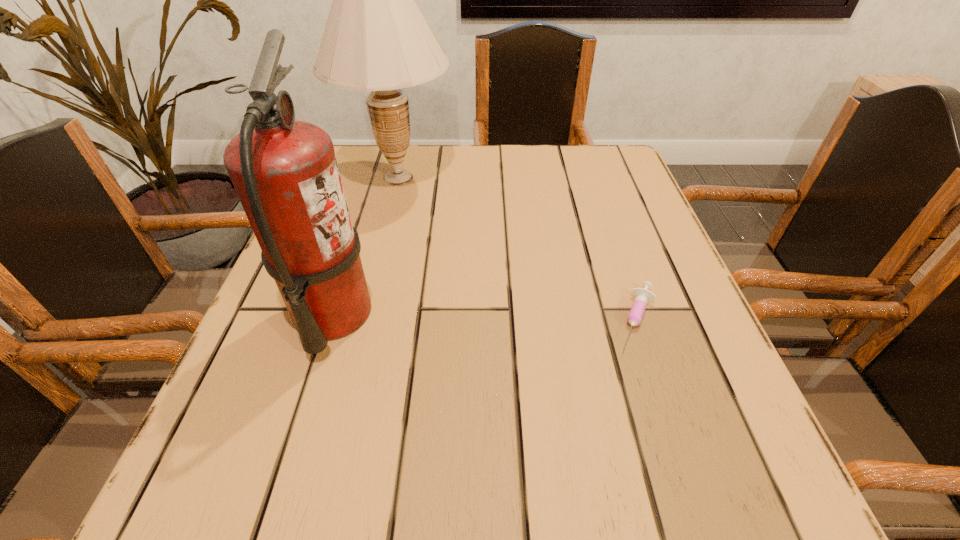
The width and height of the screenshot is (960, 540). Identify the location of object identified as the closest to the fire extinguisher. (376, 39).

Identify which object is located as the nearest to the farthest object. Please provide its 2D coordinates. Your answer should be formatted as a tuple, i.e. [(x, y)], where the tuple contains the x and y coordinates of a point satisfying the conditions above.

[(285, 172)]

Where is `vacant space that satisfies the following two spatial constraints: 1. toward the nozzle of the fire extinguisher; 2. on the left side of the syringe`? vacant space that satisfies the following two spatial constraints: 1. toward the nozzle of the fire extinguisher; 2. on the left side of the syringe is located at coordinates [331, 319].

This screenshot has width=960, height=540. I want to click on vacant space that satisfies the following two spatial constraints: 1. on the front side of the syringe; 2. on the left side of the lampshade, so pyautogui.click(x=363, y=319).

At what (x,y) coordinates should I click in order to perform the action: click on free location that satisfies the following two spatial constraints: 1. toward the nozzle of the fire extinguisher; 2. on the left side of the shortest object. Please return your answer as a coordinate pair (x, y). The height and width of the screenshot is (540, 960). Looking at the image, I should click on (331, 319).

Find the location of a particular element. This screenshot has height=540, width=960. vacant area in the image that satisfies the following two spatial constraints: 1. toward the nozzle of the fire extinguisher; 2. on the left side of the shortest object is located at coordinates (331, 319).

In order to click on blank area in the image that satisfies the following two spatial constraints: 1. on the back side of the shortest object; 2. toward the nozzle of the fire extinguisher in this screenshot , I will do `click(635, 314)`.

You are a GUI agent. You are given a task and a screenshot of the screen. Output one action in this format:
    pyautogui.click(x=<x>, y=<y>)
    Task: Click on the free space that satisfies the following two spatial constraints: 1. toward the nozzle of the fire extinguisher; 2. on the right side of the shortest object
    
    Given the screenshot: What is the action you would take?
    pyautogui.click(x=331, y=319)

Identify the location of vacant space that satisfies the following two spatial constraints: 1. on the back side of the syringe; 2. toward the nozzle of the fire extinguisher. (635, 314).

What are the coordinates of `free location that satisfies the following two spatial constraints: 1. toward the nozzle of the shortest object; 2. on the right side of the fire extinguisher` in the screenshot? It's located at (331, 319).